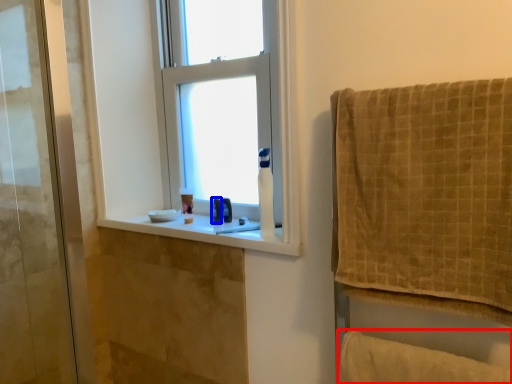
Question: Which object appears closest to the camera in this image, bath towel (highlighted by a red box) or toiletry (highlighted by a blue box)?

Choices:
 (A) bath towel
 (B) toiletry

Answer: (A)